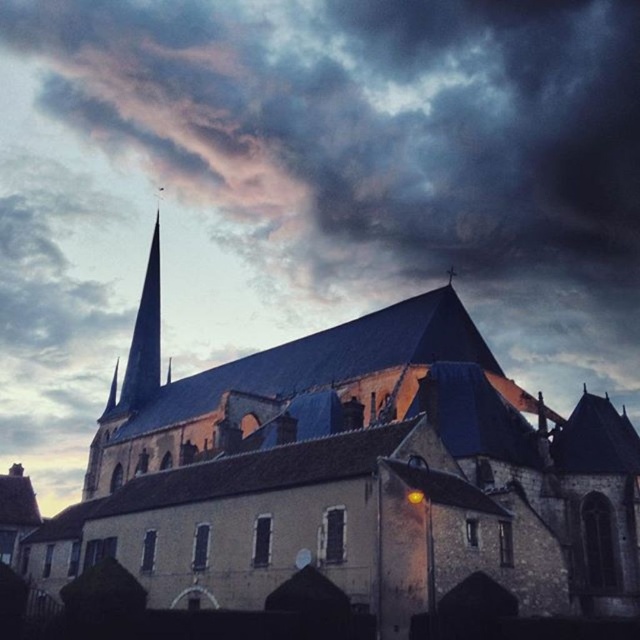
You are an architect analyzing the image. You need to determine the spatial relationship between the stone church at center and the smooth dark gray spire at upper left. Which object is wider?

The stone church at center is wider than the smooth dark gray spire at upper left because the description states that the stone church at center surpasses the spire in width.

You are standing in front of the historic stone church at center and looking towards the smooth dark gray spire at upper left. Which direction should you walk to get closer to the spire?

You should walk to the left because the stone church at center is to the right of the smooth dark gray spire at upper left, meaning the spire is located to the left side of the church from your perspective.

You are standing in front of the historic stone church at center and want to take a photo of the smooth dark gray spire at upper left. Since the spire is farther away, will it appear smaller in your photo compared to the church?

Yes, the stone church at center is closer to the viewer than the smooth dark gray spire at upper left, so the spire will appear smaller in the photo compared to the church.